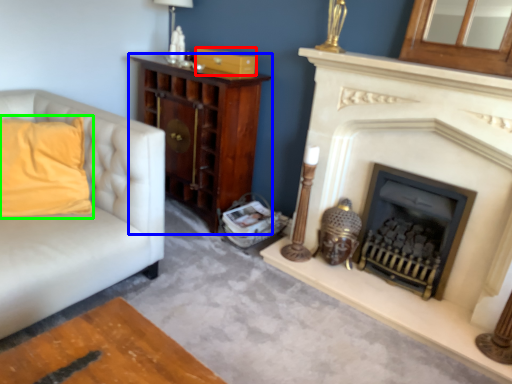
Question: Based on their relative distances, which object is farther from drawer (highlighted by a red box)? Choose from cabinetry (highlighted by a blue box) and pillow (highlighted by a green box).

Choices:
 (A) cabinetry
 (B) pillow

Answer: (B)